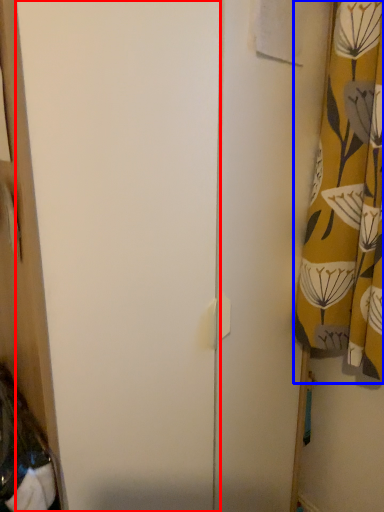
Question: Which of the following is the farthest to the observer, screen door (highlighted by a red box) or curtain (highlighted by a blue box)?

Choices:
 (A) screen door
 (B) curtain

Answer: (B)